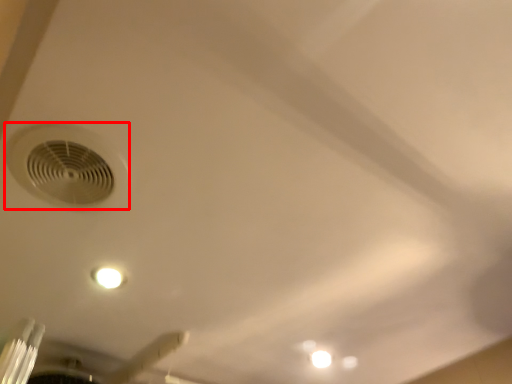
Question: From the image's perspective, what is the correct spatial positioning of air conditioning (annotated by the red box) in reference to ceiling fan?

Choices:
 (A) below
 (B) above

Answer: (B)